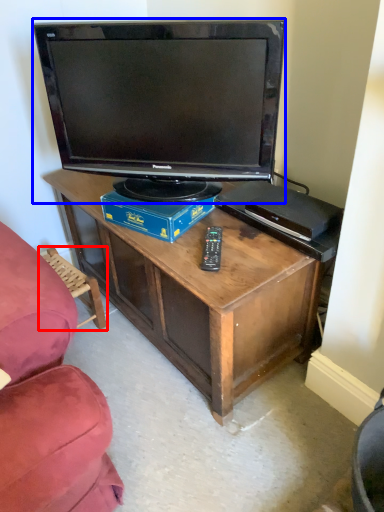
Question: Which object appears farthest to the camera in this image, swivel chair (highlighted by a red box) or television (highlighted by a blue box)?

Choices:
 (A) swivel chair
 (B) television

Answer: (A)